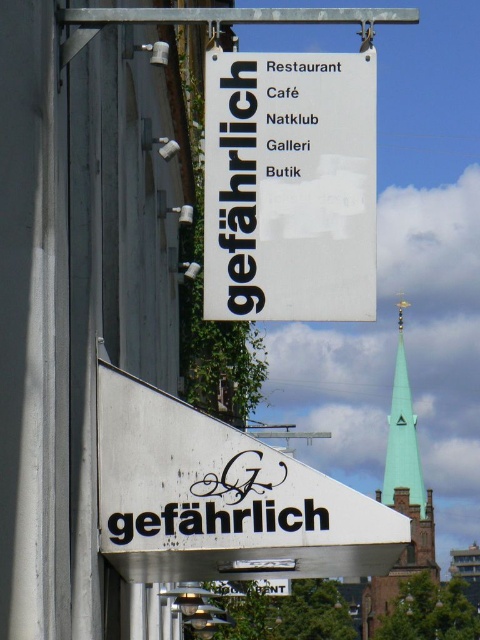
Does green glass spire at right appear on the left side of green glass spire at upper center?

Indeed, green glass spire at right is positioned on the left side of green glass spire at upper center.

Between point (375, 608) and point (397, 452), which one is positioned in front?

Point (375, 608) is more forward.

Find the location of a particular element. The height and width of the screenshot is (640, 480). green glass spire at right is located at coordinates (402, 497).

Can you confirm if black matte sign at center is smaller than white matte sign at center?

Actually, black matte sign at center might be larger than white matte sign at center.

Does black matte sign at center lie behind white matte sign at center?

No, it is in front of white matte sign at center.

Identify the location of black matte sign at center. (289, 186).

Can you confirm if black matte sign at center is thinner than green glass spire at right?

Indeed, black matte sign at center has a lesser width compared to green glass spire at right.

Can you confirm if black matte sign at center is positioned to the left of green glass spire at right?

Correct, you'll find black matte sign at center to the left of green glass spire at right.

Measure the distance between black matte sign at center and camera.

black matte sign at center is 36.78 meters away from camera.

At what (x,y) coordinates should I click in order to perform the action: click on black matte sign at center. Please return your answer as a coordinate pair (x, y). Looking at the image, I should click on (289, 186).